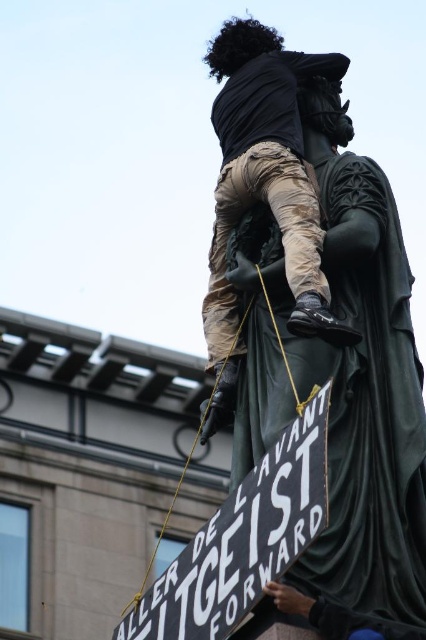
You are a photographer standing at the base of the statue. You want to take a photo of the camouflage pants at upper center while also including the camera in the frame. Given that the distance between them is 48.12 meters, do you think your camera can capture both in a single shot?

The camouflage pants at upper center and camera are 48.12 meters apart. Depending on the camera lens, a wide angle lens may be required to capture both in a single shot since the distance between them is quite large.

You are a photographer trying to capture the statue and the sign in the same frame. The statue is green marble statue at center and the sign is black matte sign at center. Given that the statue is thinner than the sign, which object should you position closer to the camera to ensure both fit within the frame?

Since the green marble statue at center is thinner than the black matte sign at center, you should position the green marble statue at center closer to the camera to ensure both fit within the frame.

You are a photographer trying to capture the entire scene of the green marble statue at center and the camouflage pants at upper center in one shot. Given that your camera has a fixed focal length, which object should you position closer to the camera to ensure both fit within the frame?

The green marble statue at center is wider than the camouflage pants at upper center. To fit both in the frame, position the green marble statue at center closer to the camera since its larger size requires it to be nearer to maintain proportion and ensure both objects are fully visible.